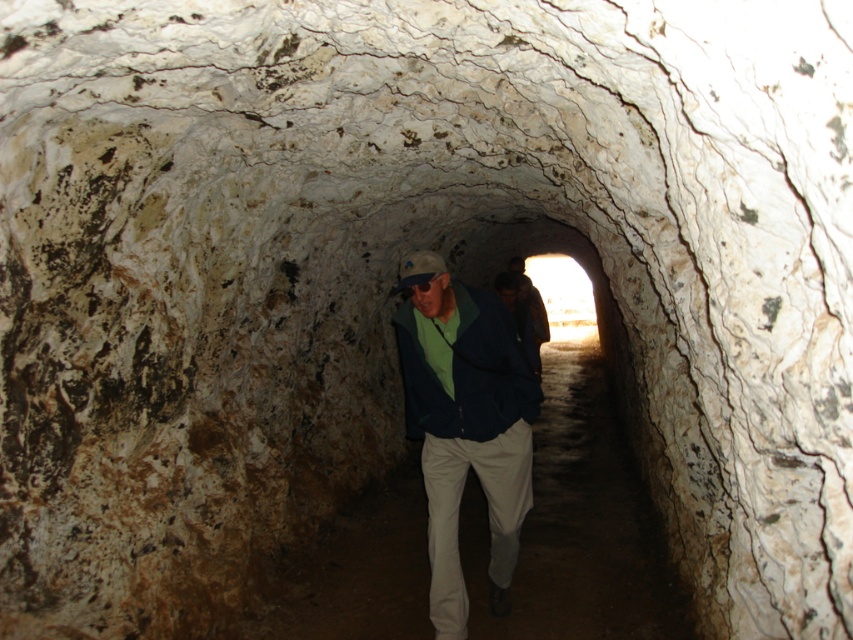
Does smooth stone path at center appear over matte blue jacket at center?

No, smooth stone path at center is not above matte blue jacket at center.

This screenshot has width=853, height=640. Find the location of `smooth stone path at center`. smooth stone path at center is located at coordinates (577, 524).

In order to click on smooth stone path at center in this screenshot , I will do `click(577, 524)`.

Can you confirm if smooth stone path at center is taller than dark brown leather jacket at center?

Incorrect, smooth stone path at center's height is not larger of dark brown leather jacket at center's.

Does smooth stone path at center appear under dark brown leather jacket at center?

Yes.

Measure the distance between smooth stone path at center and camera.

smooth stone path at center and camera are 5.99 meters apart.

I want to click on smooth stone path at center, so click(577, 524).

Is matte blue jacket at center to the left of dark brown leather jacket at center from the viewer's perspective?

Correct, you'll find matte blue jacket at center to the left of dark brown leather jacket at center.

Find the location of `matte blue jacket at center`. matte blue jacket at center is located at coordinates (466, 372).

I want to click on matte blue jacket at center, so click(x=466, y=372).